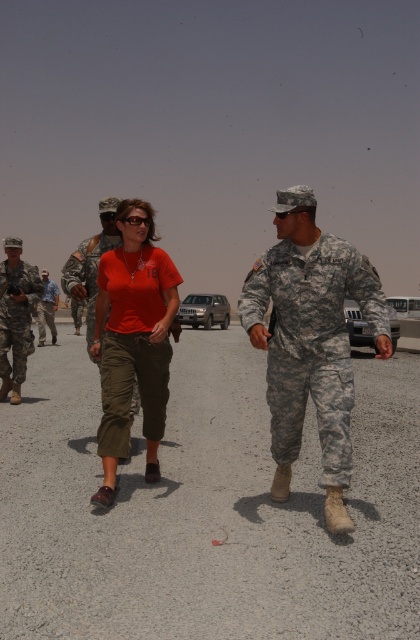
Between point (154, 404) and point (20, 394), which one is positioned behind?

Positioned behind is point (20, 394).

Find the location of a particular element. The image size is (420, 640). matte orange t-shirt at center is located at coordinates (133, 339).

From the picture: Who is more distant from viewer, (128, 358) or (31, 289)?

Positioned behind is point (31, 289).

At what (x,y) coordinates should I click in order to perform the action: click on matte orange t-shirt at center. Please return your answer as a coordinate pair (x, y). The height and width of the screenshot is (640, 420). Looking at the image, I should click on (133, 339).

Between camouflage uniform at center and camouflage uniform at left, which one has less height?

Standing shorter between the two is camouflage uniform at left.

Is camouflage uniform at center shorter than camouflage uniform at left?

Incorrect, camouflage uniform at center's height does not fall short of camouflage uniform at left's.

Who is more distant from viewer, (359, 298) or (33, 269)?

Positioned behind is point (33, 269).

The width and height of the screenshot is (420, 640). In order to click on camouflage uniform at center in this screenshot , I will do `click(310, 340)`.

Is matte orange t-shirt at center positioned behind camouflage fabric uniform at center?

No, it is not.

Is matte orange t-shirt at center smaller than camouflage fabric uniform at center?

No.

The image size is (420, 640). Identify the location of matte orange t-shirt at center. (133, 339).